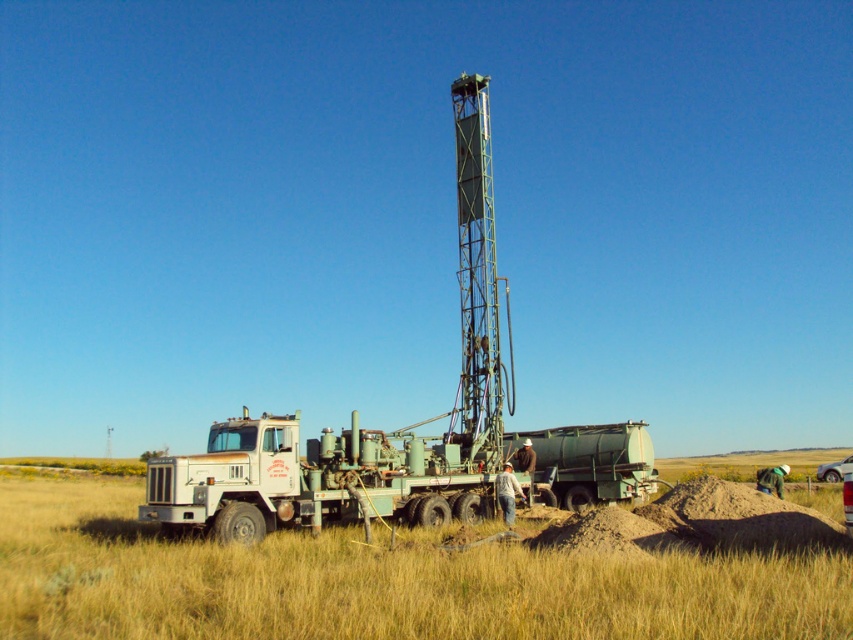
Does yellow grass at lower center have a larger size compared to white matte truck at center?

Indeed, yellow grass at lower center has a larger size compared to white matte truck at center.

Does yellow grass at lower center appear under white matte truck at center?

Correct, yellow grass at lower center is located below white matte truck at center.

You are a GUI agent. You are given a task and a screenshot of the screen. Output one action in this format:
    pyautogui.click(x=<x>, y=<y>)
    Task: Click on the yellow grass at lower center
    The width and height of the screenshot is (853, 640).
    Given the screenshot: What is the action you would take?
    pyautogui.click(x=376, y=580)